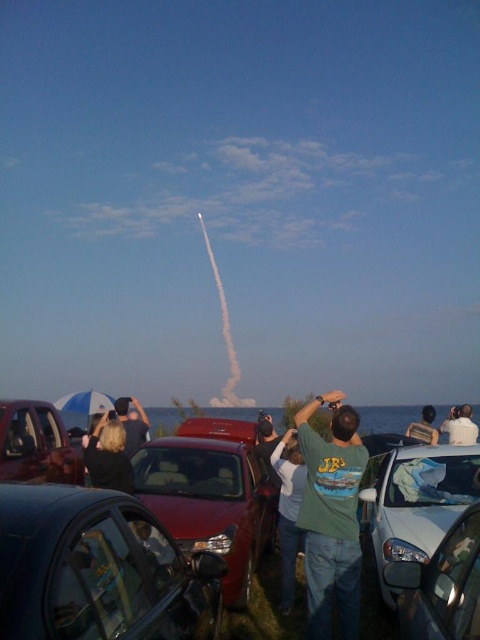
Image resolution: width=480 pixels, height=640 pixels. What do you see at coordinates (414, 500) in the screenshot? I see `metallic silver car at lower right` at bounding box center [414, 500].

Who is more distant from viewer, (409, 528) or (136, 435)?

Point (136, 435)

The height and width of the screenshot is (640, 480). I want to click on metallic silver car at lower right, so click(x=414, y=500).

Is shiny black car at lower left below metallic silver car at lower left?

No.

Does point (17, 592) lie behind point (54, 481)?

No.

Locate an element on the screen. The height and width of the screenshot is (640, 480). shiny black car at lower left is located at coordinates (97, 570).

Where is `shiny red car at center`? shiny red car at center is located at coordinates click(x=211, y=500).

The image size is (480, 640). Describe the element at coordinates (211, 500) in the screenshot. I see `shiny red car at center` at that location.

Locate an element on the screen. The height and width of the screenshot is (640, 480). shiny red car at center is located at coordinates pos(211,500).